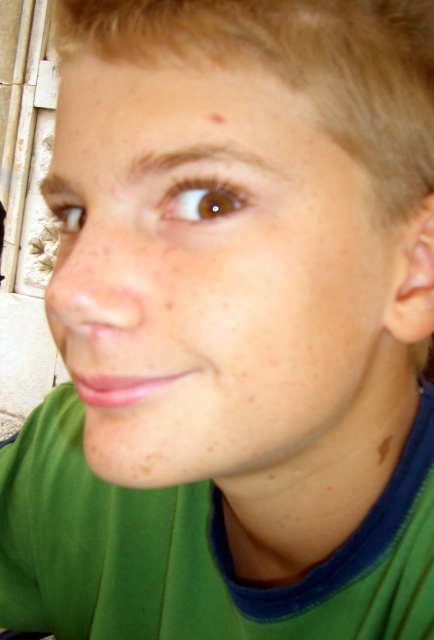
You are a photographer adjusting the focus of your camera. You want to ensure that both the smooth skin face at center and the brown matte freckle at upper center are clearly visible in the photo. Given their sizes, which object should you prioritize focusing on to ensure clarity?

The smooth skin face at center is larger in size than the brown matte freckle at upper center, so you should prioritize focusing on the smooth skin face at center to ensure clarity since larger objects generally require more precise focus to maintain sharpness.

You are a photographer adjusting your camera to capture a close portrait. The subject has a smooth skin face at center and a brown matte freckle at lower right. How far apart are these two features on the subject?

The smooth skin face at center is 5.12 inches away from the brown matte freckle at lower right.